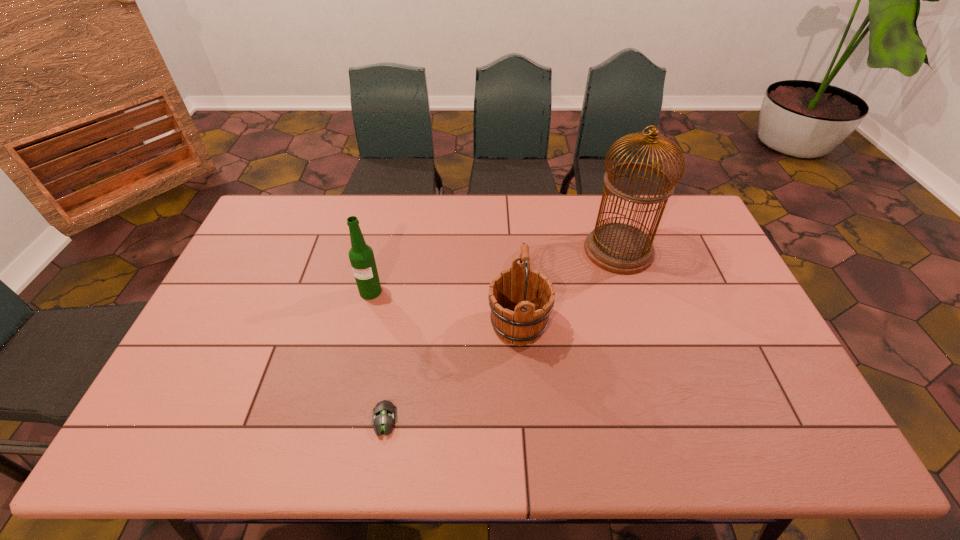
This screenshot has width=960, height=540. What are the coordinates of `free location that satisfies the following two spatial constraints: 1. on the label of the beer bottle; 2. on the right side of the computer mouse` in the screenshot? It's located at (341, 420).

Find the location of `vacant area that satisfies the following two spatial constraints: 1. on the label of the leftmost object; 2. on the left side of the third object from left to right`. vacant area that satisfies the following two spatial constraints: 1. on the label of the leftmost object; 2. on the left side of the third object from left to right is located at coordinates pos(363,325).

The image size is (960, 540). Find the location of `free point that satisfies the following two spatial constraints: 1. on the front-facing side of the farthest object; 2. on the label of the beer bottle`. free point that satisfies the following two spatial constraints: 1. on the front-facing side of the farthest object; 2. on the label of the beer bottle is located at coordinates pyautogui.click(x=632, y=292).

Locate an element on the screen. The image size is (960, 540). vacant position in the image that satisfies the following two spatial constraints: 1. on the front-facing side of the birdcage; 2. on the label of the beer bottle is located at coordinates (632, 292).

Image resolution: width=960 pixels, height=540 pixels. What are the coordinates of `vacant region that satisfies the following two spatial constraints: 1. on the label of the leftmost object; 2. on the left side of the computer mouse` in the screenshot? It's located at (341, 420).